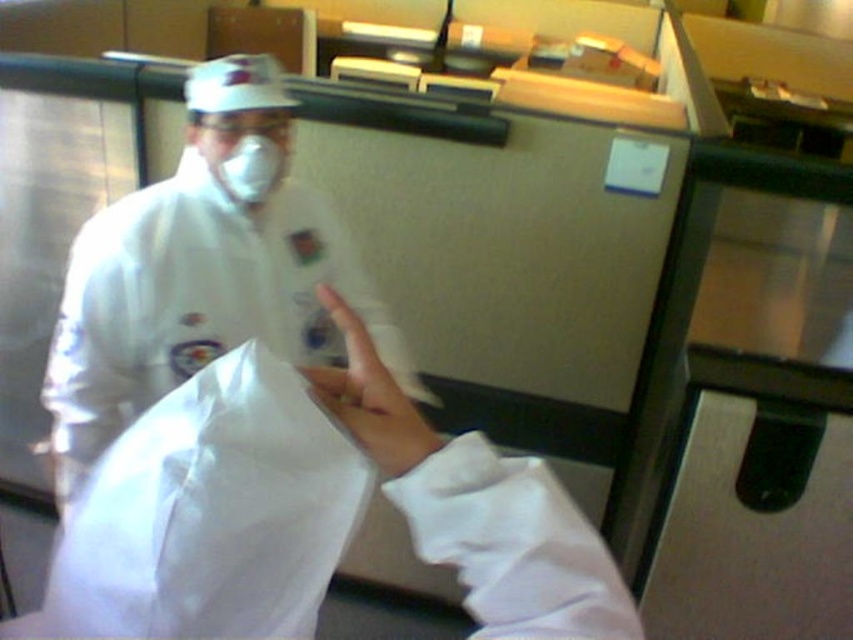
You are a delivery person who needs to hand over a package to the person wearing the white matte lab coat at center. The delivery requires you to approach within 3 feet to hand over the package. Can you safely do so?

The white matte lab coat at center is 3.61 feet away from camera. Since the required distance for delivery is 3 feet, you can safely approach within the needed distance as 3.61 feet is greater than 3 feet.

You are a food safety inspector in this kitchen. You notice the white matte lab coat at center and the white matte hand at center. Which object is bigger?

The white matte lab coat at center is larger than the white matte hand at center.

Based on the photo, you are a delivery person who needs to place a package on the counter. The package is 15 cm in height. Is there enough vertical space between the white matte lab coat at center and the top of the counter to place the package?

The vertical space between the white matte lab coat at center and the top of the counter is not specified in the provided information, so it cannot be determined if there is enough space to place the 15 cm tall package.